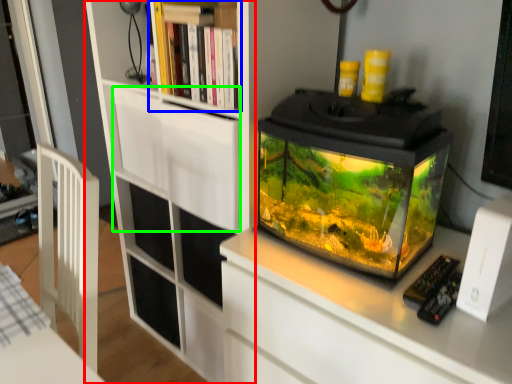
Question: Which is farther away from bookcase (highlighted by a red box)? shelf (highlighted by a blue box) or drawer (highlighted by a green box)?

Choices:
 (A) shelf
 (B) drawer

Answer: (A)